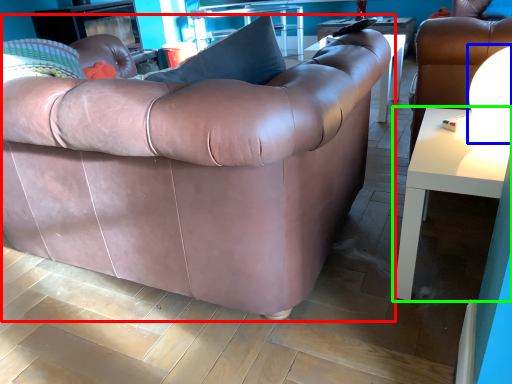
Question: Which is nearer to the studio couch (highlighted by a red box)? lamp (highlighted by a blue box) or table (highlighted by a green box).

Choices:
 (A) lamp
 (B) table

Answer: (B)